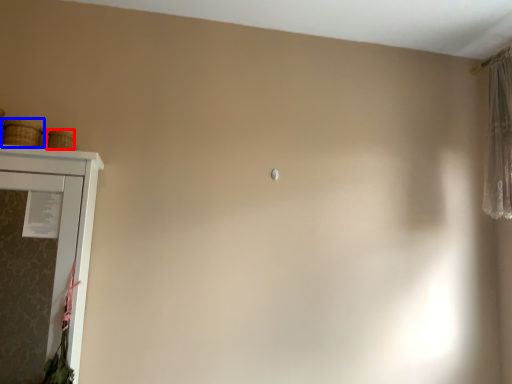
Question: Which object is closer to the camera taking this photo, basket (highlighted by a red box) or basket (highlighted by a blue box)?

Choices:
 (A) basket
 (B) basket

Answer: (B)